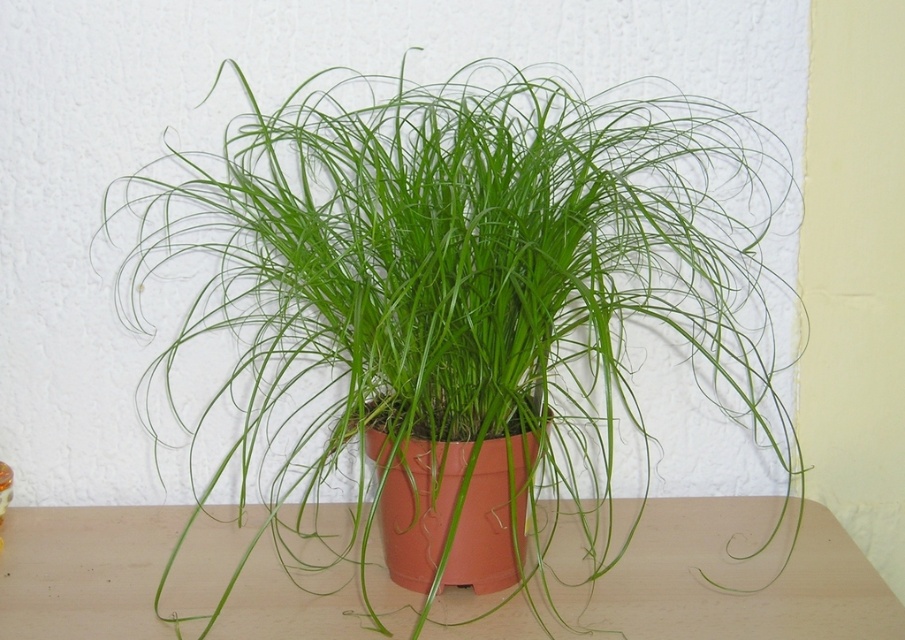
Is green glossy plant at center above matte orange pot at center?

Correct, green glossy plant at center is located above matte orange pot at center.

Is green glossy plant at center positioned behind matte orange pot at center?

No, green glossy plant at center is closer to the viewer.

Locate an element on the screen. Image resolution: width=905 pixels, height=640 pixels. green glossy plant at center is located at coordinates (459, 300).